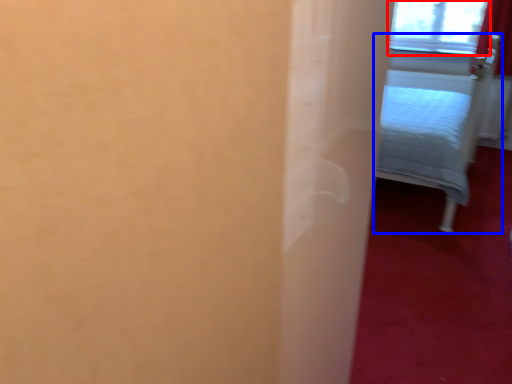
Question: Which object is closer to the camera taking this photo, window (highlighted by a red box) or furniture (highlighted by a blue box)?

Choices:
 (A) window
 (B) furniture

Answer: (B)